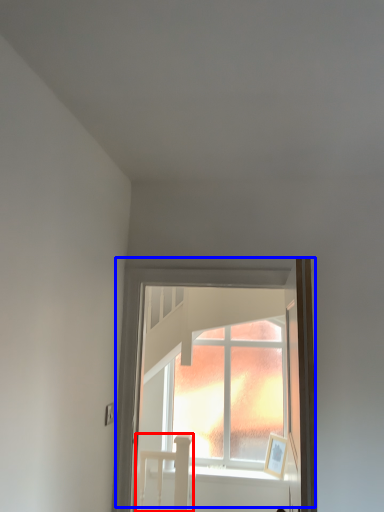
Question: Which object is closer to the camera taking this photo, bed (highlighted by a red box) or window (highlighted by a blue box)?

Choices:
 (A) bed
 (B) window

Answer: (B)